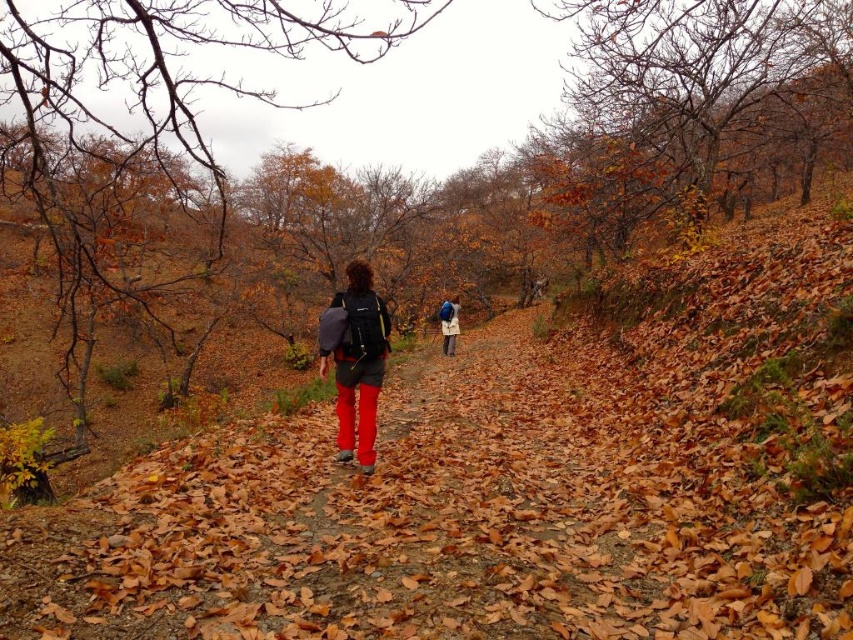
Does matte black backpack at center have a greater height compared to blue fabric backpack at center?

Yes, matte black backpack at center is taller than blue fabric backpack at center.

Does matte black backpack at center come behind blue fabric backpack at center?

No, matte black backpack at center is closer to the viewer.

Between point (352, 408) and point (445, 314), which one is positioned behind?

The point (445, 314) is behind.

Locate an element on the screen. This screenshot has width=853, height=640. matte black backpack at center is located at coordinates (355, 360).